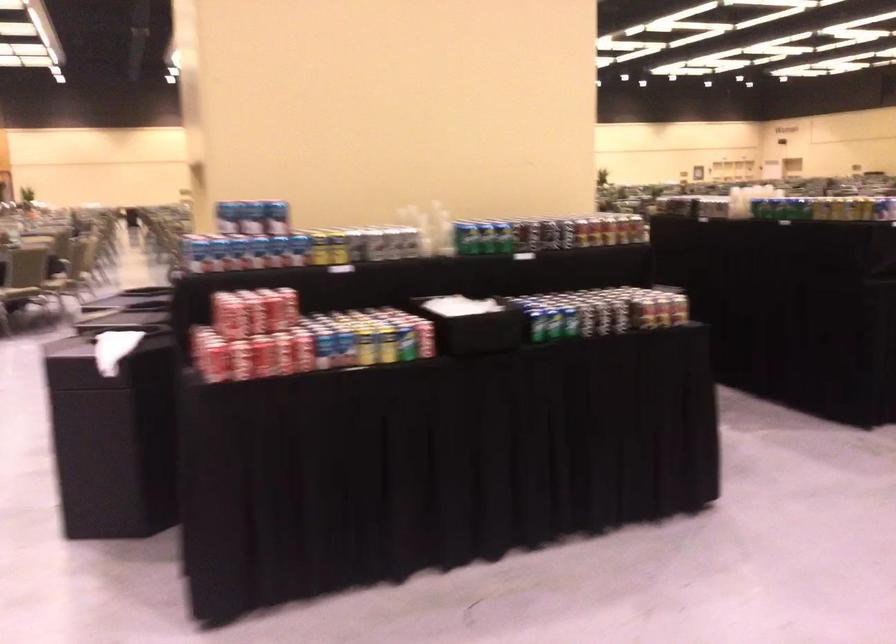
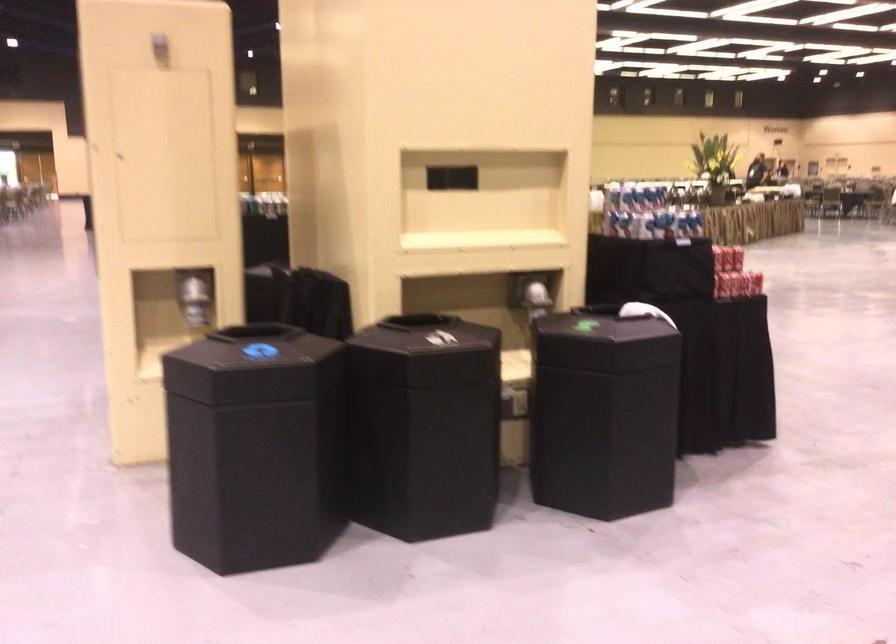
Question: I am providing you with two images of the same scene from different viewpoints. Which of the following objects are not visible in image2?

Choices:
 (A) shiny dispenser lever
 (B) black bin lid
 (C) silver soda can
 (D) net clamp screw

Answer: (C)